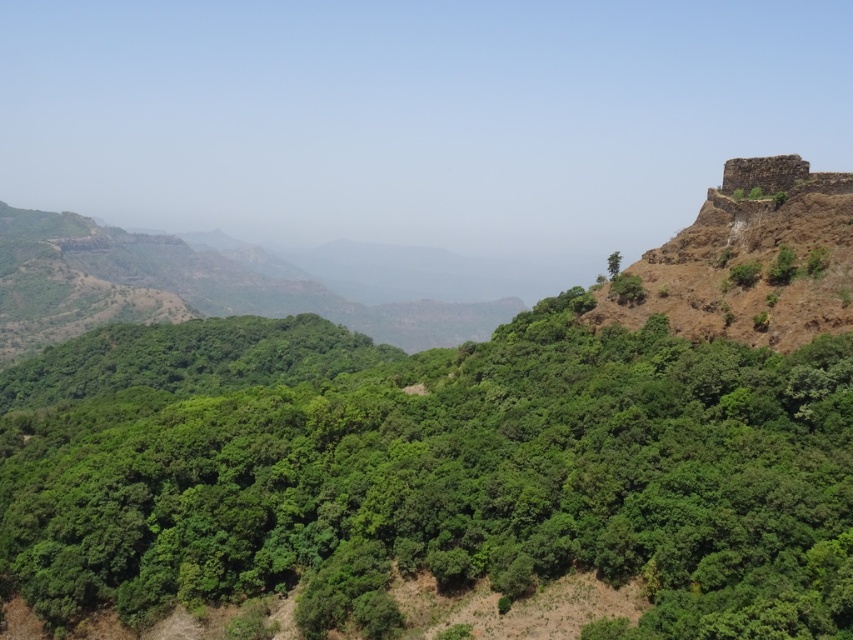
Question: Which of the following is the farthest from the observer?

Choices:
 (A) (611, 259)
 (B) (749, 164)
 (C) (345, 490)

Answer: (A)

Question: Which of the following is the farthest from the observer?

Choices:
 (A) rustic stone fort at upper right
 (B) green leafy trees at center
 (C) green leafy tree at upper right

Answer: (C)

Question: Among these objects, which one is farthest from the camera?

Choices:
 (A) green leafy tree at upper right
 (B) rustic stone fort at upper right

Answer: (A)

Question: Considering the relative positions of rustic stone fort at upper right and green leafy tree at upper right in the image provided, where is rustic stone fort at upper right located with respect to green leafy tree at upper right?

Choices:
 (A) below
 (B) above

Answer: (B)

Question: Does rustic stone fort at upper right appear on the right side of green leafy tree at upper right?

Choices:
 (A) no
 (B) yes

Answer: (B)

Question: Is rustic stone fort at upper right below green leafy tree at upper right?

Choices:
 (A) yes
 (B) no

Answer: (B)